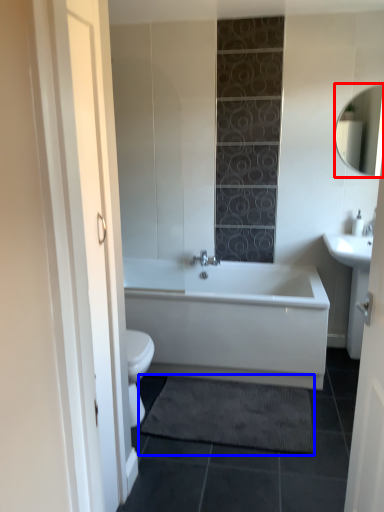
Question: Which object is further to the camera taking this photo, mirror (highlighted by a red box) or bath mat (highlighted by a blue box)?

Choices:
 (A) mirror
 (B) bath mat

Answer: (A)